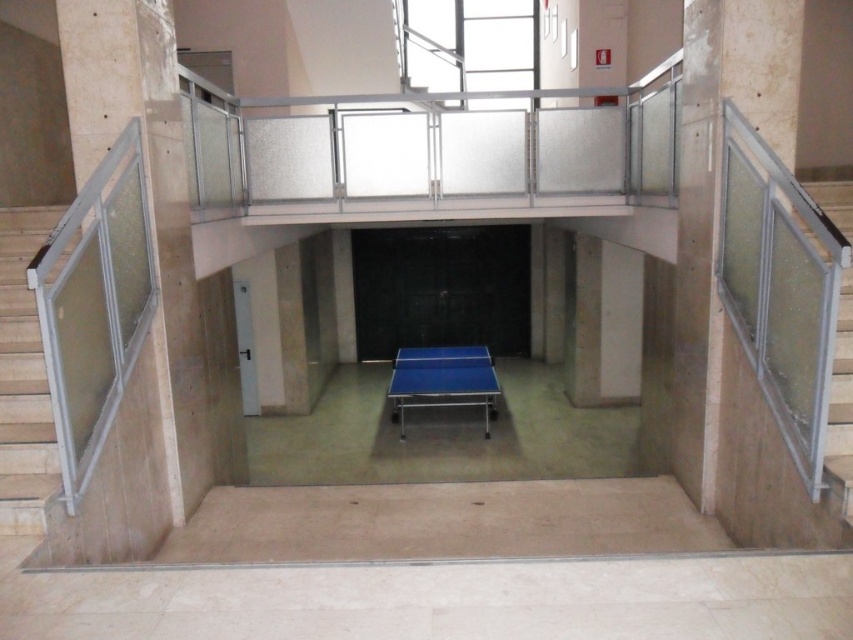
Question: Is blue glossy table tennis table at center positioned in front of blue rubber table tennis table at center?

Choices:
 (A) no
 (B) yes

Answer: (B)

Question: Which of the following is the closest to the observer?

Choices:
 (A) (851, 404)
 (B) (397, 364)
 (C) (38, 246)

Answer: (A)

Question: Which of the following is the closest to the observer?

Choices:
 (A) (442, 356)
 (B) (398, 378)

Answer: (B)

Question: Is metallic gray handrail at left wider than blue rubber table tennis table at center?

Choices:
 (A) yes
 (B) no

Answer: (A)

Question: Is metallic gray handrail at left to the left of clear glass railing at right from the viewer's perspective?

Choices:
 (A) yes
 (B) no

Answer: (A)

Question: Which point appears closest to the camera in this image?

Choices:
 (A) (482, 362)
 (B) (403, 394)
 (C) (10, 349)

Answer: (C)